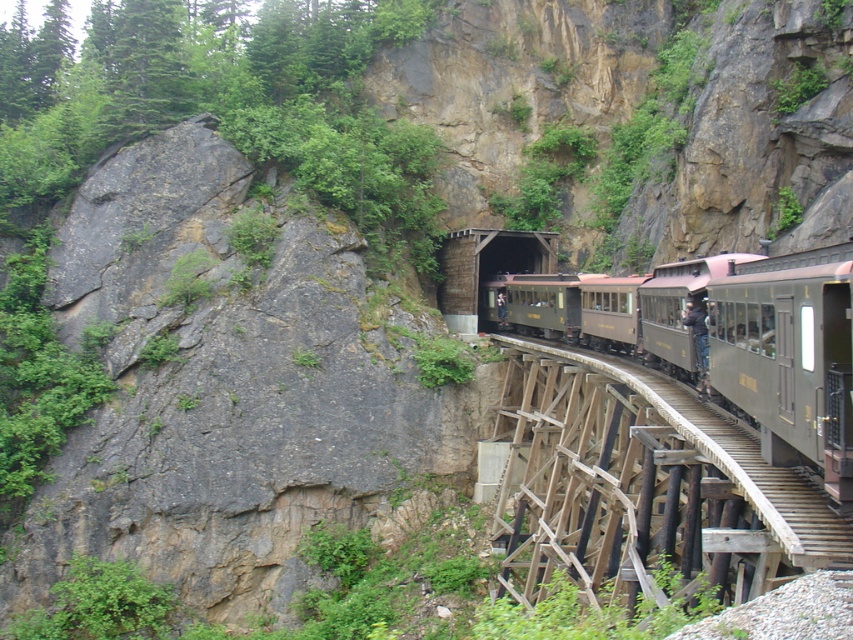
Can you confirm if wooden at center is thinner than matte black train car at center?

Yes.

In the scene shown: Between wooden at center and matte black train car at center, which one is positioned lower?

Positioned lower is wooden at center.

I want to click on wooden at center, so click(x=642, y=486).

Does wooden at center appear over green wooden bridge at center?

Incorrect, wooden at center is not positioned above green wooden bridge at center.

This screenshot has width=853, height=640. Describe the element at coordinates (642, 486) in the screenshot. I see `wooden at center` at that location.

Is point (553, 467) positioned in front of point (482, 316)?

Yes, point (553, 467) is closer to viewer.

The image size is (853, 640). I want to click on wooden at center, so click(x=642, y=486).

Which of these two, matte black train car at center or green wooden bridge at center, stands taller?

green wooden bridge at center is taller.

Is matte black train car at center above green wooden bridge at center?

No, matte black train car at center is not above green wooden bridge at center.

Identify the location of matte black train car at center. (767, 348).